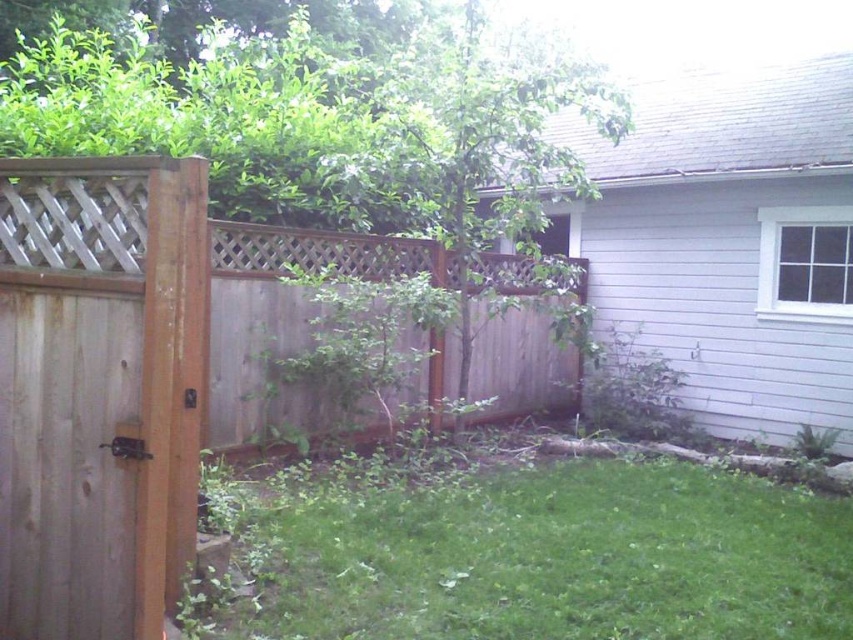
Question: Estimate the real-world distances between objects in this image. Which object is closer to the brown wood gate at left?

Choices:
 (A) green grass at lower center
 (B) brown wood fence at left

Answer: (A)

Question: Among these objects, which one is farthest from the camera?

Choices:
 (A) green grass at lower center
 (B) brown wood fence at left
 (C) brown wood gate at left

Answer: (B)

Question: Can you confirm if brown wood gate at left is positioned to the left of brown wood fence at left?

Choices:
 (A) yes
 (B) no

Answer: (B)

Question: Is green grass at lower center below brown wood fence at left?

Choices:
 (A) yes
 (B) no

Answer: (A)

Question: Is brown wood gate at left smaller than brown wood fence at left?

Choices:
 (A) yes
 (B) no

Answer: (B)

Question: Estimate the real-world distances between objects in this image. Which object is closer to the brown wood gate at left?

Choices:
 (A) brown wood fence at left
 (B) green grass at lower center

Answer: (B)